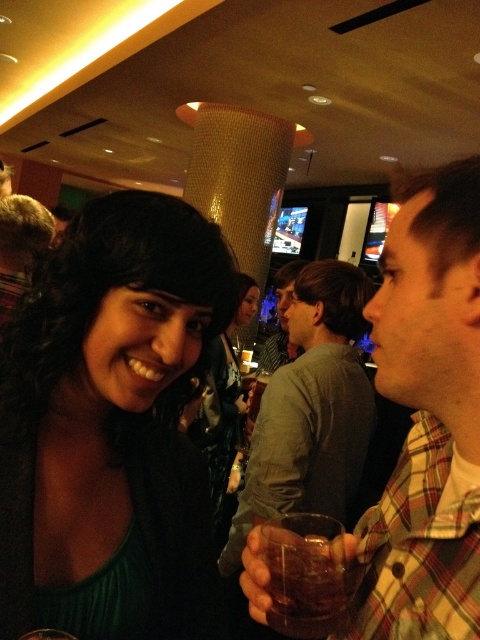
You are a photographer standing 10 feet away from the green matte dress at center. Can you take a clear photo of it without moving closer?

The green matte dress at center is 20.53 inches from the camera. Since 20.53 inches is approximately 1.71 feet, and you are standing 10 feet away, you are much farther than the dress. Therefore, you can take a clear photo without moving closer.

You are a photographer setting up a shot of the scene. You want to ensure both the plaid fabric shirt at right and the translucent glass at center are in focus. Based on their positions, which object should you focus on first to capture both effectively?

The plaid fabric shirt at right is to the right of the translucent glass at center. To capture both in focus, you should focus on the translucent glass at center first since it is closer to the camera, ensuring the shirt in the background remains sharp.

Based on the description, where is the plaid fabric shirt at right located in the image?

The plaid fabric shirt at right is located at the coordinates point (427, 419) in the image.